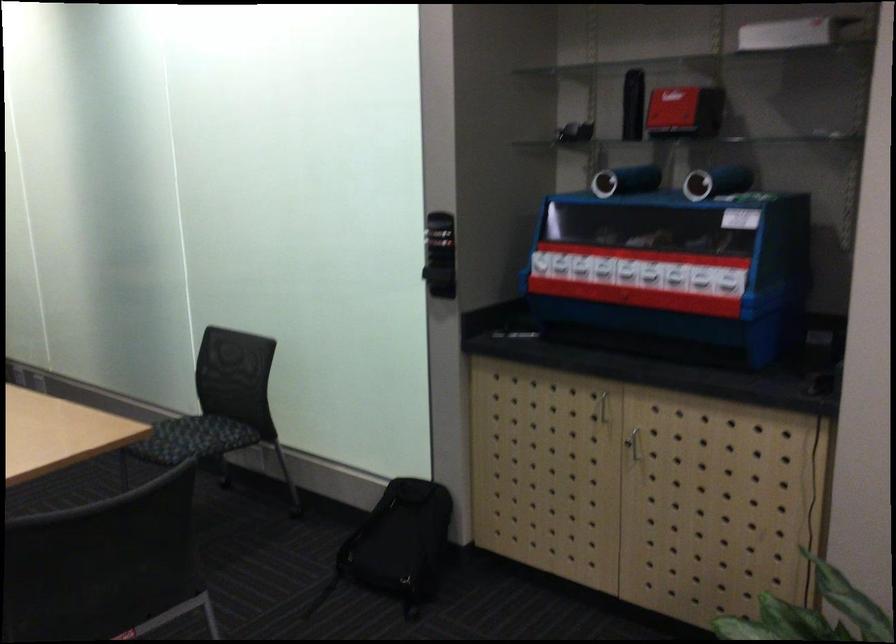
Find where to lift the black cylindrical container. Please return your answer as a coordinate pair (x, y).

(717, 182)